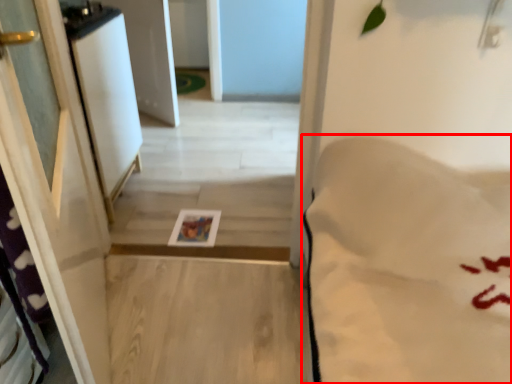
Question: From the image, what is the correct spatial relationship of sheet (annotated by the red box) in relation to screen door?

Choices:
 (A) right
 (B) left

Answer: (A)